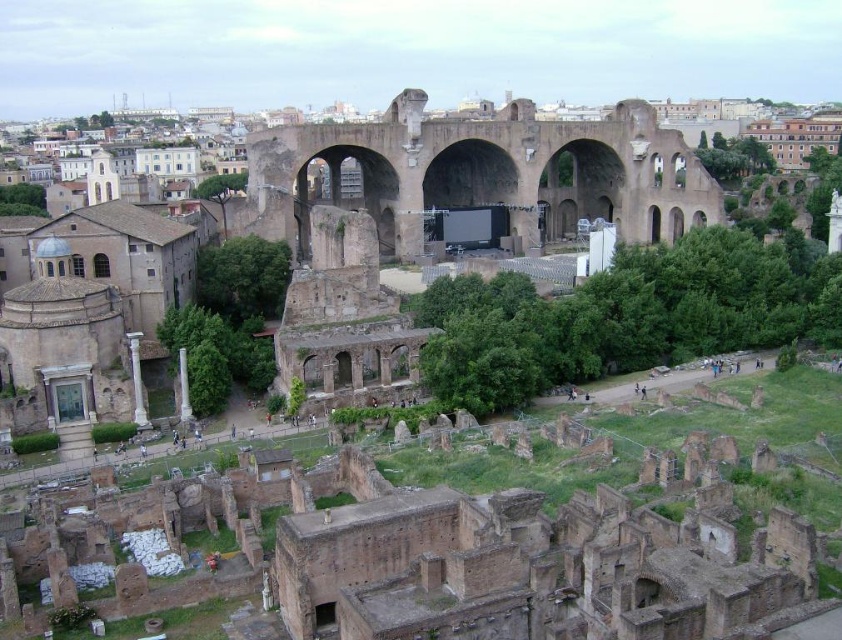
Question: Is white marble column at lower left to the left of white marble pillar at lower left from the viewer's perspective?

Choices:
 (A) no
 (B) yes

Answer: (B)

Question: Which of the following is the closest to the observer?

Choices:
 (A) (x=179, y=388)
 (B) (x=621, y=189)

Answer: (A)

Question: Can you confirm if brown stone ruins at center is positioned to the left of white marble column at lower left?

Choices:
 (A) yes
 (B) no

Answer: (B)

Question: Which point is farther to the camera?

Choices:
 (A) brown stone ruins at center
 (B) white marble pillar at lower left

Answer: (A)

Question: Is brown stone ruins at center positioned before white marble column at lower left?

Choices:
 (A) yes
 (B) no

Answer: (B)

Question: Which point appears farthest from the camera in this image?

Choices:
 (A) (185, 380)
 (B) (144, 412)
 (C) (409, 186)

Answer: (C)